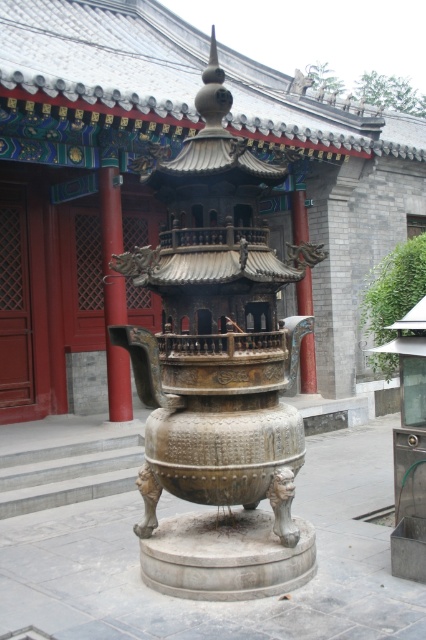
Question: Does smooth red pillar at center appear on the right side of bronze textured pillar at center?

Choices:
 (A) no
 (B) yes

Answer: (A)

Question: Which of the following is the farthest from the observer?

Choices:
 (A) (302, 214)
 (B) (111, 170)

Answer: (A)

Question: Is smooth red pillar at center closer to the viewer compared to bronze textured pillar at center?

Choices:
 (A) no
 (B) yes

Answer: (B)

Question: Which object appears closest to the camera in this image?

Choices:
 (A) smooth red pillar at center
 (B) bronze textured pillar at center

Answer: (A)

Question: Is smooth red pillar at center below bronze textured pillar at center?

Choices:
 (A) no
 (B) yes

Answer: (A)